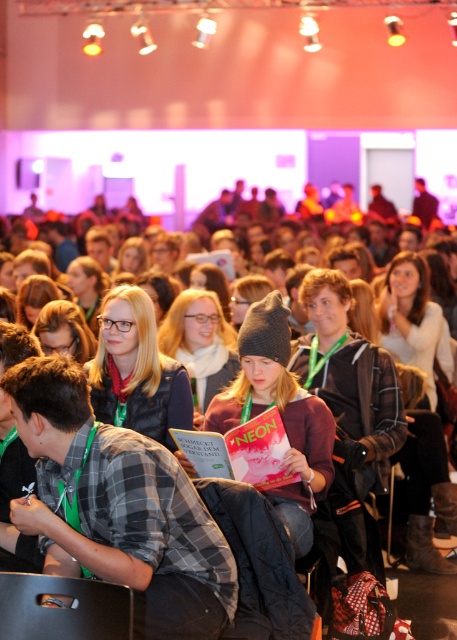
You are an event organizer who needs to take a photo of the audience. You notice a knit gray beanie at center and a matte black vest at center. To ensure both are visible in the frame, which object should you focus on first?

You should focus on the matte black vest at center first because the knit gray beanie at center is located below it, so adjusting the camera angle to capture the higher positioned object ensures both are in the frame.

You are an event organizer at the conference and need to retrieve a misplaced item. You remember seeing a knit gray beanie at center and a matte gray beanie at center. Which beanie is located below the other?

The knit gray beanie at center is positioned under the matte gray beanie at center, so the knit gray beanie is below the matte gray beanie.

You are organizing a charity event and need to stack two beanies for a donation box. The beanies are the knit gray beanie at center and the matte gray beanie at center. Which beanie should you place on top to ensure stability?

To ensure stability, place the shorter matte gray beanie at center on top of the taller knit gray beanie at center since the knit gray beanie at center is taller than the matte gray beanie at center.